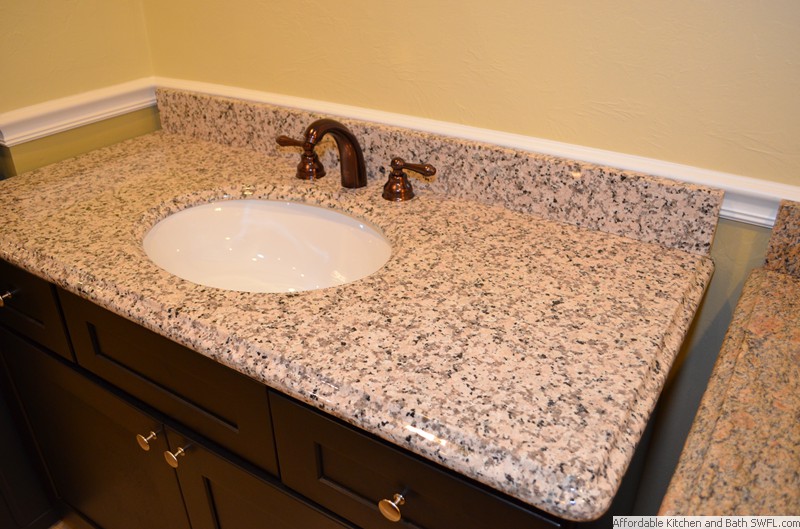
Where is `edge of second counter`? The width and height of the screenshot is (800, 529). edge of second counter is located at coordinates (746, 435).